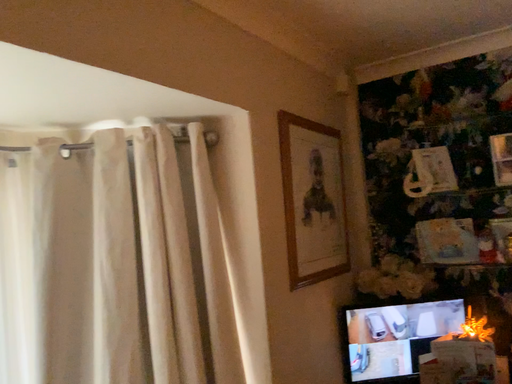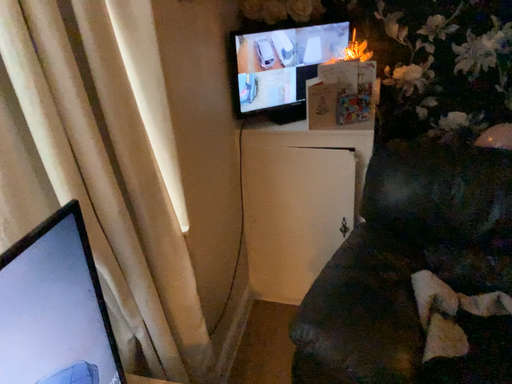
Question: How did the camera likely rotate when shooting the video?

Choices:
 (A) rotated left
 (B) rotated right

Answer: (B)